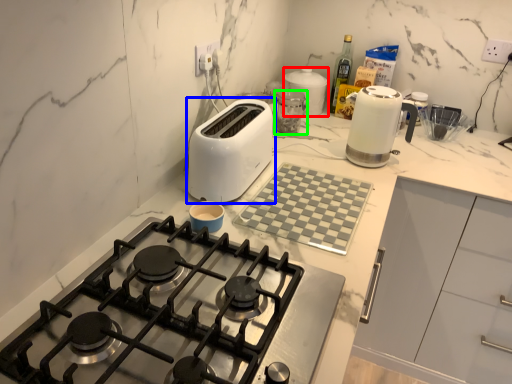
Question: Estimate the real-world distances between objects in this image. Which object is closer to kitchen appliance (highlighted by a red box), toaster (highlighted by a blue box) or kitchen appliance (highlighted by a green box)?

Choices:
 (A) toaster
 (B) kitchen appliance

Answer: (B)